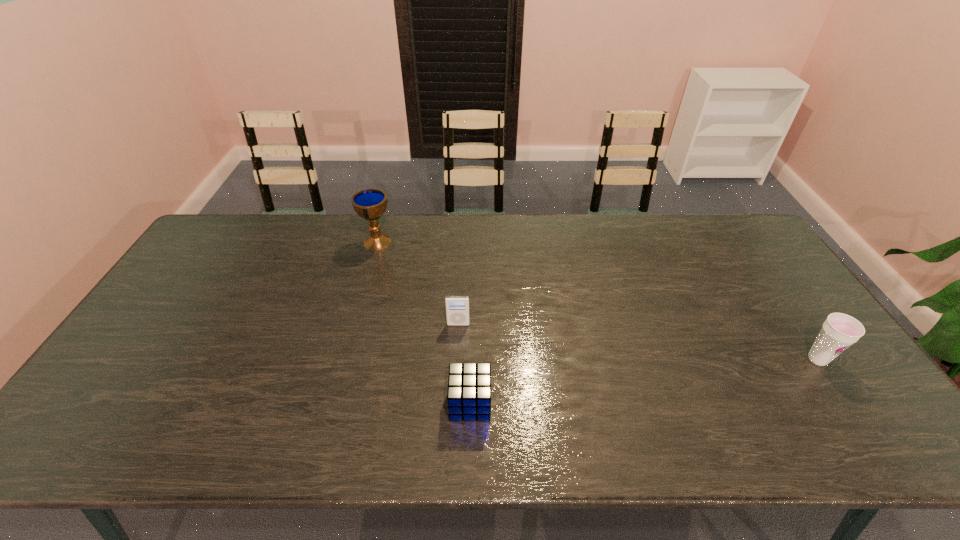
This screenshot has width=960, height=540. Find the location of `vacant area that lies between the chalice and the second nearest object`. vacant area that lies between the chalice and the second nearest object is located at coordinates (597, 301).

The width and height of the screenshot is (960, 540). I want to click on free area in between the third farthest object and the chalice, so click(x=597, y=301).

You are a GUI agent. You are given a task and a screenshot of the screen. Output one action in this format:
    pyautogui.click(x=<x>, y=<y>)
    Task: Click on the empty space between the leftmost object and the cube
    This screenshot has height=540, width=960.
    Given the screenshot: What is the action you would take?
    pyautogui.click(x=423, y=323)

You are a GUI agent. You are given a task and a screenshot of the screen. Output one action in this format:
    pyautogui.click(x=<x>, y=<y>)
    Task: Click on the vacant area between the third farthest object and the cube
    The image size is (960, 540).
    Given the screenshot: What is the action you would take?
    pyautogui.click(x=644, y=381)

What are the coordinates of `free spot between the cube and the second tallest object` in the screenshot? It's located at (644, 381).

Find the location of a particular element. free spot between the chalice and the second farthest object is located at coordinates pos(418,283).

At what (x,y) coordinates should I click in order to perform the action: click on object that can be found as the third closest to the chalice. Please return your answer as a coordinate pair (x, y). The image size is (960, 540). Looking at the image, I should click on (839, 331).

Point out which object is positioned as the third nearest to the cube. Please provide its 2D coordinates. Your answer should be formatted as a tuple, i.e. [(x, y)], where the tuple contains the x and y coordinates of a point satisfying the conditions above.

[(839, 331)]

The width and height of the screenshot is (960, 540). Identify the location of free space that satisfies the following two spatial constraints: 1. on the front-facing side of the cube; 2. on the right side of the iPod. (455, 403).

At what (x,y) coordinates should I click in order to perform the action: click on free spot that satisfies the following two spatial constraints: 1. on the front side of the nearest object; 2. on the left side of the tallest object. Please return your answer as a coordinate pair (x, y). The width and height of the screenshot is (960, 540). Looking at the image, I should click on (334, 403).